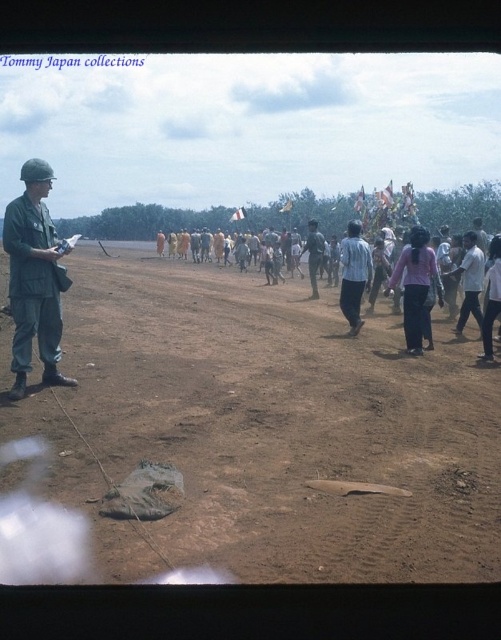
Question: Does brown sandy dirt at center lie behind pink fabric pants at center-right?

Choices:
 (A) no
 (B) yes

Answer: (A)

Question: Which of the following is the farthest from the observer?

Choices:
 (A) light brown fabric people at center
 (B) matte green uniform at left
 (C) pink fabric pants at center-right
 (D) dark green uniform at center

Answer: (D)

Question: Which point is farther to the camera?

Choices:
 (A) (407, 310)
 (B) (436, 273)
 (C) (52, 234)
 (D) (148, 420)

Answer: (A)

Question: Does pink fabric pants at center-right appear over dark green uniform at center?

Choices:
 (A) no
 (B) yes

Answer: (A)

Question: Can you confirm if matte green uniform at left is bigger than pink fabric pants at center-right?

Choices:
 (A) yes
 (B) no

Answer: (A)

Question: Estimate the real-world distances between objects in this image. Which object is farther from the matte green uniform at left?

Choices:
 (A) light brown fabric people at center
 (B) pink fabric pants at center-right

Answer: (A)